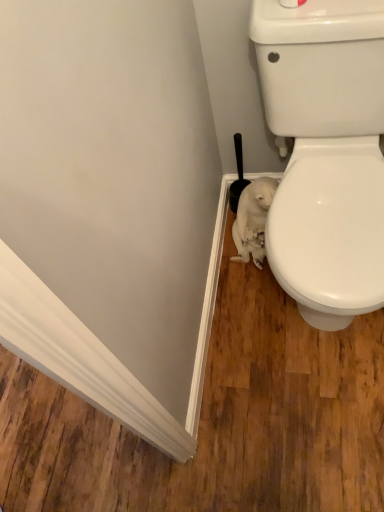
Identify the location of vacant space in front of white fur animal at lower right. (260, 287).